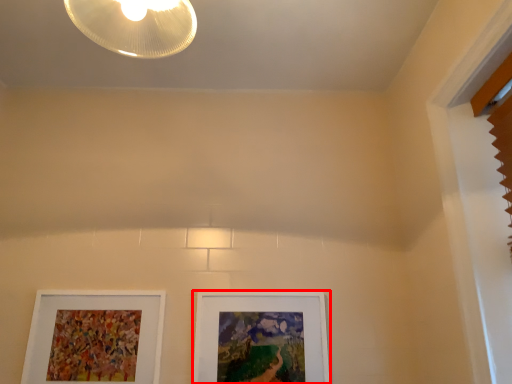
Question: Considering the relative positions of picture frame (annotated by the red box) and picture frame in the image provided, where is picture frame (annotated by the red box) located with respect to the staircase?

Choices:
 (A) right
 (B) left

Answer: (A)